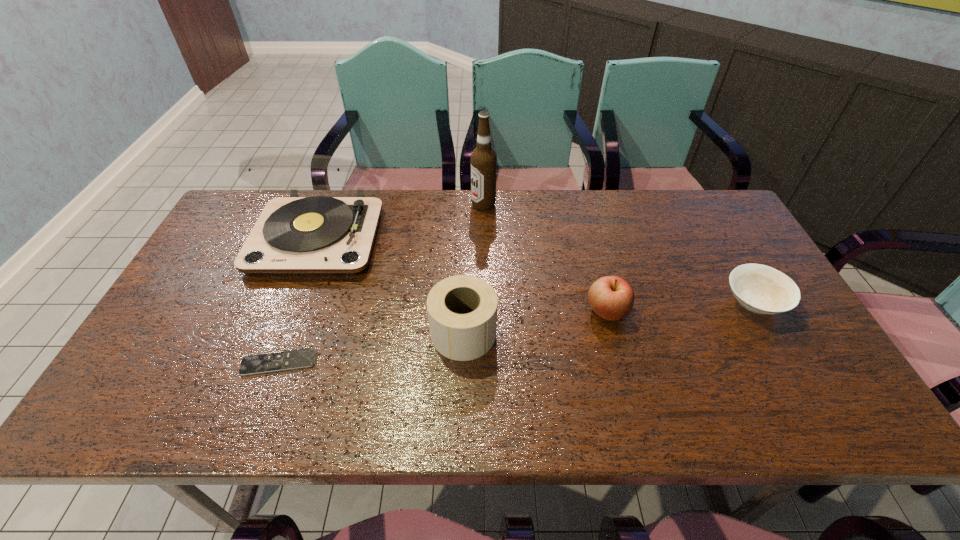
I want to click on alcohol, so click(x=483, y=158).

At what (x,y) coordinates should I click in order to perform the action: click on record player. Please return your answer as a coordinate pair (x, y). Looking at the image, I should click on (319, 235).

The height and width of the screenshot is (540, 960). I want to click on toilet tissue, so click(462, 310).

What are the coordinates of `the second object from right to left` in the screenshot? It's located at coord(611,297).

Locate an element on the screen. Image resolution: width=960 pixels, height=540 pixels. bowl is located at coordinates (761, 289).

I want to click on the rightmost object, so click(x=761, y=289).

Identify the location of the shortest object. Image resolution: width=960 pixels, height=540 pixels. (300, 358).

I want to click on vacant space located 0.380m on the label of the alcohol, so click(x=355, y=205).

You are a GUI agent. You are given a task and a screenshot of the screen. Output one action in this format:
    pyautogui.click(x=<x>, y=<y>)
    Task: Click on the vacant space located on the label of the alcohol
    
    Given the screenshot: What is the action you would take?
    pyautogui.click(x=383, y=205)

Where is `blank space located 0.230m on the label of the alcohol`? blank space located 0.230m on the label of the alcohol is located at coordinates (401, 205).